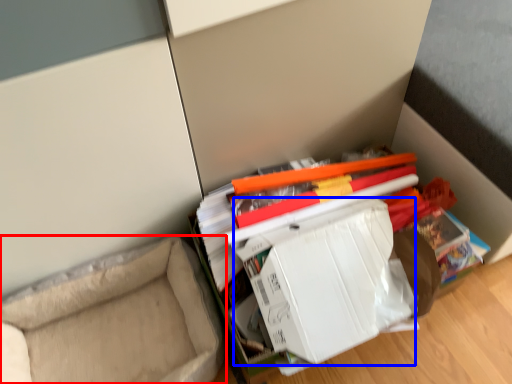
Question: Which object appears farthest to the camera in this image, furniture (highlighted by a red box) or paperback book (highlighted by a blue box)?

Choices:
 (A) furniture
 (B) paperback book

Answer: (A)